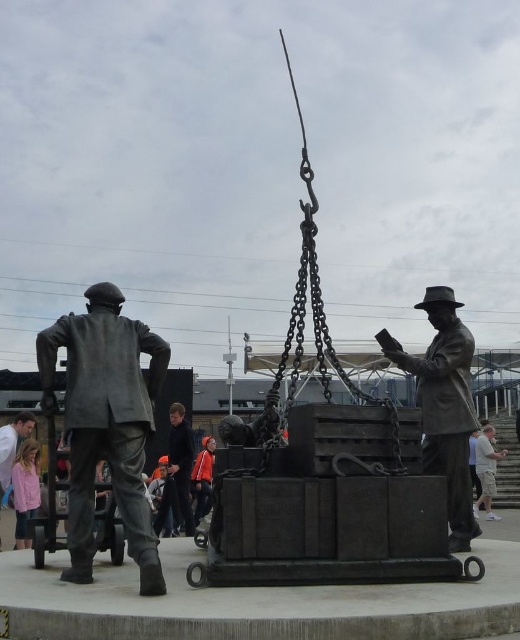
You are a maintenance worker who needs to reach the bronze statue at right and the light gray shorts at lower right. Your ladder is 25 feet long. Can you safely reach both objects with this ladder?

The distance between the bronze statue at right and the light gray shorts at lower right is 29.78 feet. Since the ladder is only 25 feet long, it is not long enough to safely reach both objects.

You are standing in front of the bronze sculpture and notice two points marked on it. The first point is at coordinates point (x=446, y=541) and the second is at point (x=448, y=362). Which point is closer to you?

Point (x=446, y=541) is in front of point (x=448, y=362), so it is closer to you.